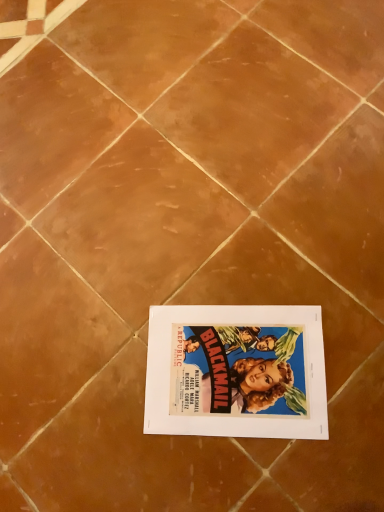
Locate an element on the screen. vacant area in front of white paper at center is located at coordinates (279, 469).